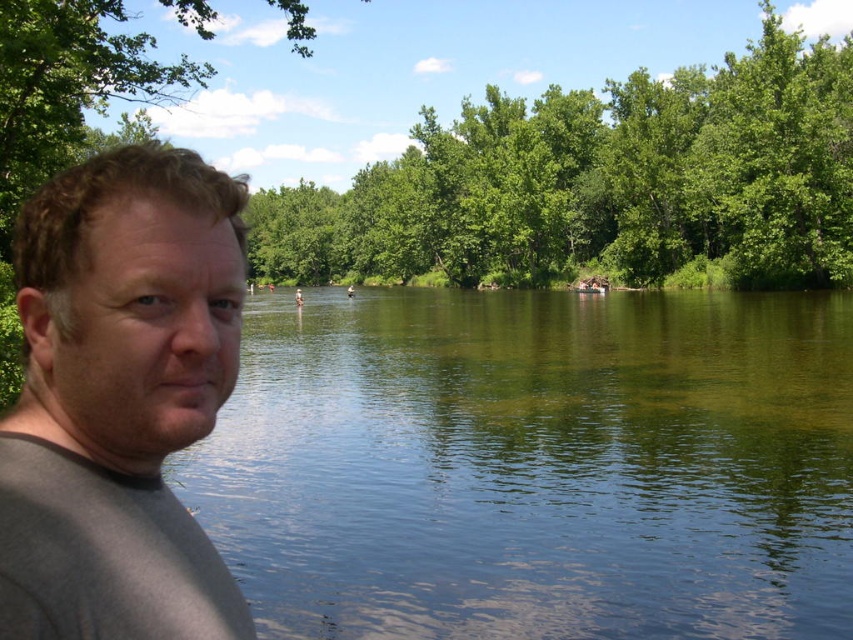
You are standing at the point closer to the camera in the scene. Which point are you at, point (822,330) or point (480,257)?

You are at point (822,330) because it is in front of point (480,257), meaning it is closer to the camera.

You are a photographer trying to capture the green reflective water at center and the gray matte shirt at left in your shot. Which object will appear larger in the photo?

The green reflective water at center will appear larger in the photo because it is bigger than the gray matte shirt at left.

You are a photographer trying to capture the scene. You want to ensure both the green reflective water at center and the green leafy trees at center are visible in your photo. Which object should you focus on to include more of it in the frame?

You should focus on the green leafy trees at center because they occupy more space than the green reflective water at center.